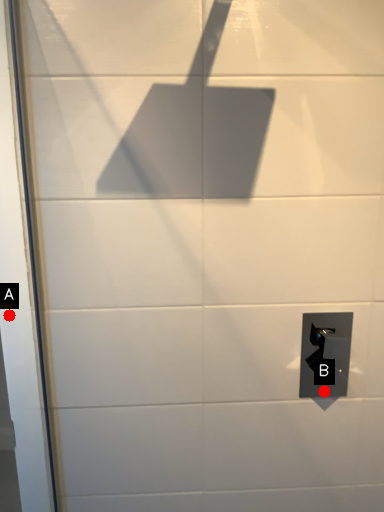
Question: Two points are circled on the image, labeled by A and B beside each circle. Which point is further to the camera?

Choices:
 (A) A is further
 (B) B is further

Answer: (B)